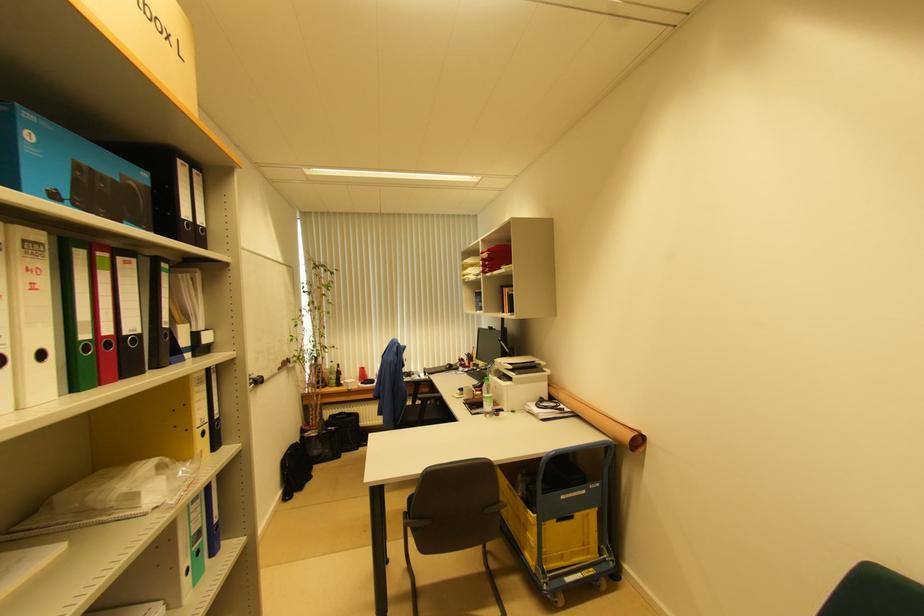
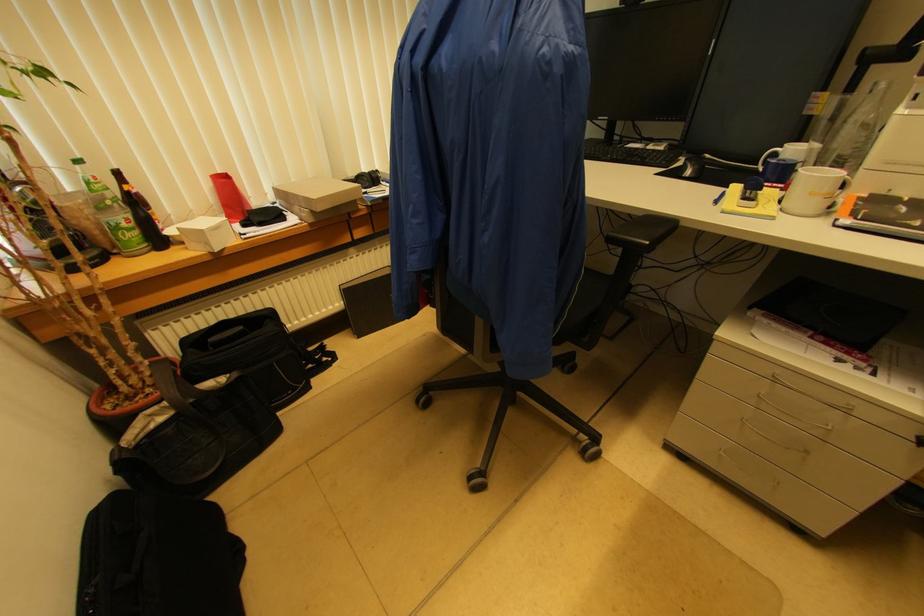
In the second image, find the point that corresponds to point 320,435 in the first image.

(175, 408)